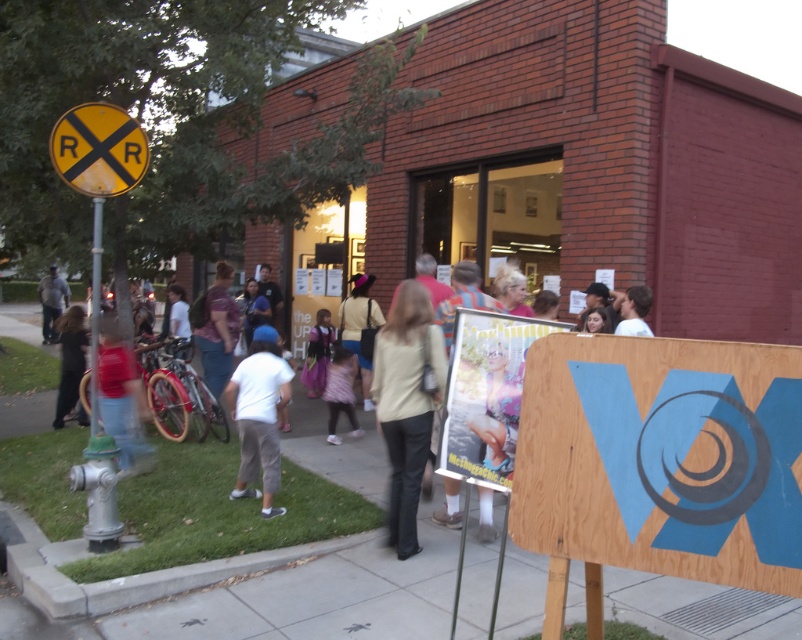
In the scene shown: You are standing in front of the brick building and notice two people wearing a white cotton shirt at center and a light pink fabric dress at center. Which clothing item is nearer to you?

The white cotton shirt at center is closer to the viewer than the light pink fabric dress at center, so the white cotton shirt at center is nearer to you.

Based on the scene description, where is the white cotton shirt at center located in terms of its 2D coordinates?

The white cotton shirt at center is located at the 2D coordinates point (258,416).